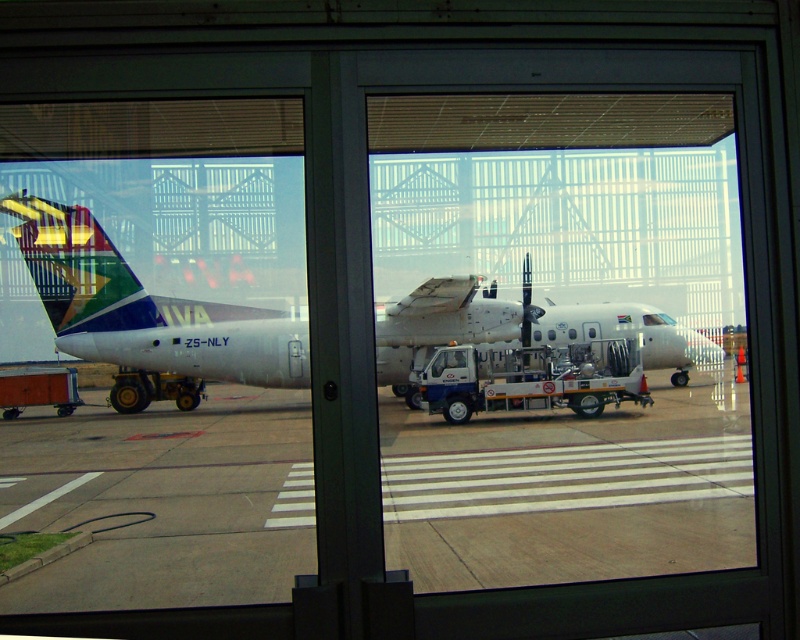
Based on the photo, is the position of transparent glass door at center less distant than that of white matte airplane at center?

No.

Is point (438, 193) positioned in front of point (396, 372)?

Yes, it is.

Where is `transparent glass door at center`? This screenshot has width=800, height=640. transparent glass door at center is located at coordinates (606, 540).